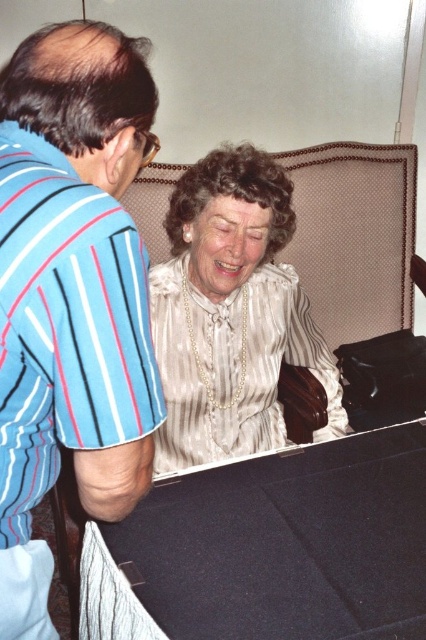
Based on the coordinates provided, which object is located at point [71,292] in the image?

The point [71,292] indicates the location of the blue striped shirt at left.

You are standing in the room and want to move from the blue striped shirt at left to the black felt table at lower center. Which direction should you move to reach the table?

The blue striped shirt at left is to the left of the black felt table at lower center, so you should move to the right to reach the table.